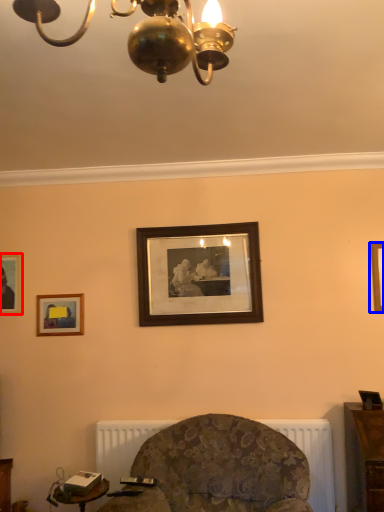
Question: Which point is further to the camera, picture frame (highlighted by a red box) or picture frame (highlighted by a blue box)?

Choices:
 (A) picture frame
 (B) picture frame

Answer: (A)